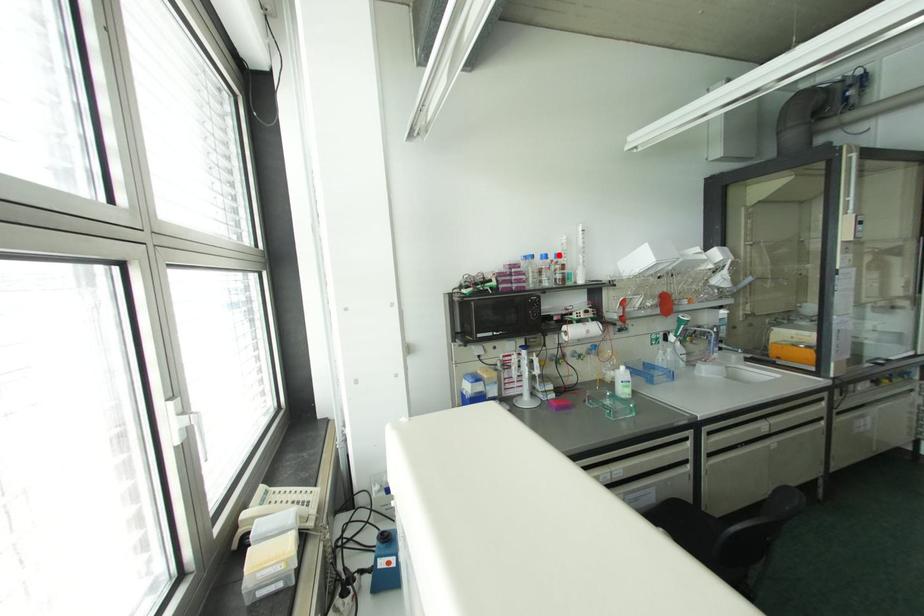
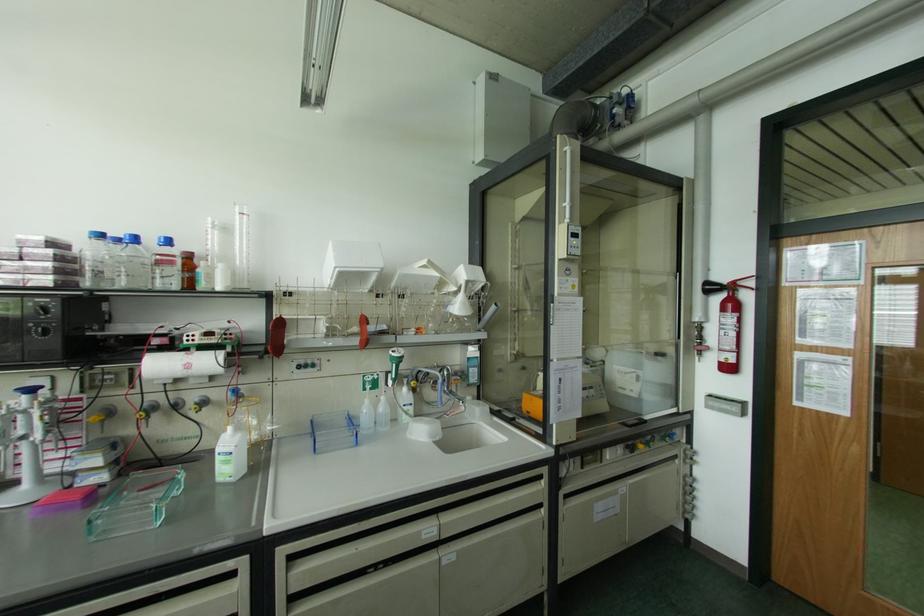
Locate, in the second image, the point that corresponds to the highlighted location in the first image.

(167, 241)